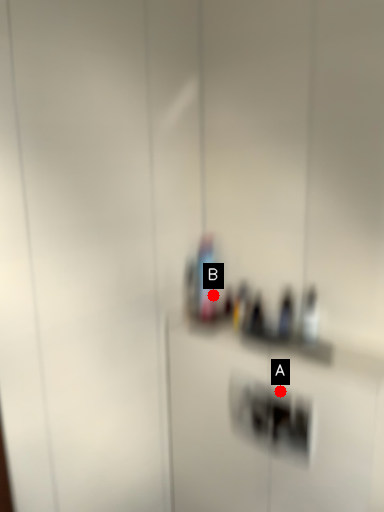
Question: Two points are circled on the image, labeled by A and B beside each circle. Which point appears farthest from the camera in this image?

Choices:
 (A) A is further
 (B) B is further

Answer: (B)